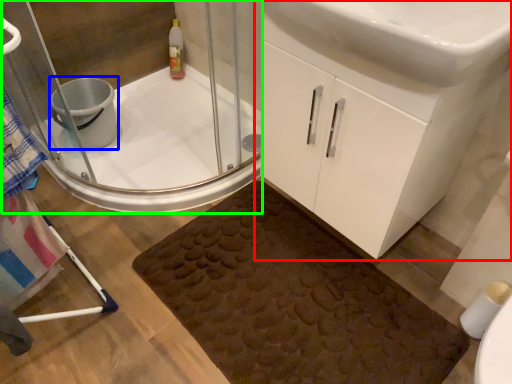
Question: Which object is the farthest from bathroom cabinet (highlighted by a red box)? Choose among these: toilet bowl (highlighted by a blue box) or shower door (highlighted by a green box).

Choices:
 (A) toilet bowl
 (B) shower door

Answer: (A)